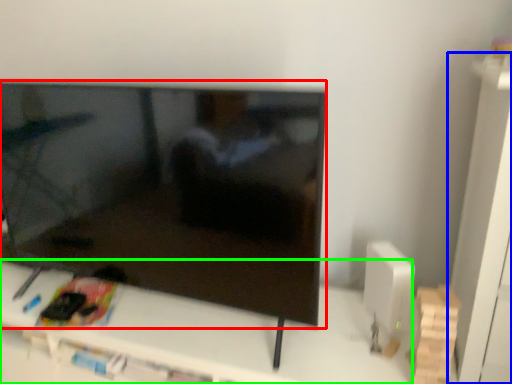
Question: Considering the real-world distances, which object is farthest from television (highlighted by a red box)? tv cabinet (highlighted by a blue box) or furniture (highlighted by a green box)?

Choices:
 (A) tv cabinet
 (B) furniture

Answer: (A)